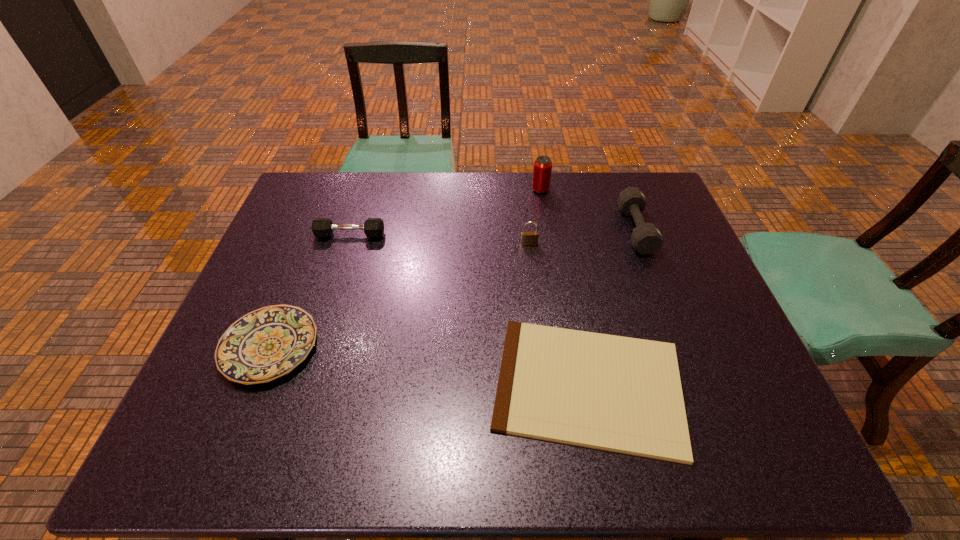
At what (x,y) coordinates should I click in order to perform the action: click on free spot that satisfies the following two spatial constraints: 1. on the back side of the fourth tallest object; 2. on the left side of the plate. Please return your answer as a coordinate pair (x, y). Looking at the image, I should click on (315, 235).

Where is `vacant space that satisfies the following two spatial constraints: 1. on the front side of the farthest object; 2. on the right side of the taller dumbbell`? vacant space that satisfies the following two spatial constraints: 1. on the front side of the farthest object; 2. on the right side of the taller dumbbell is located at coordinates (547, 230).